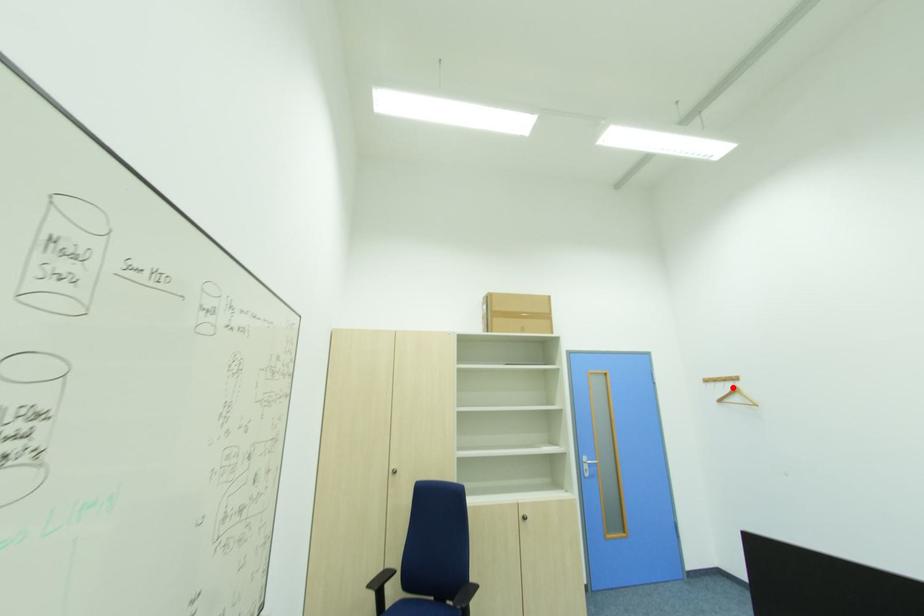
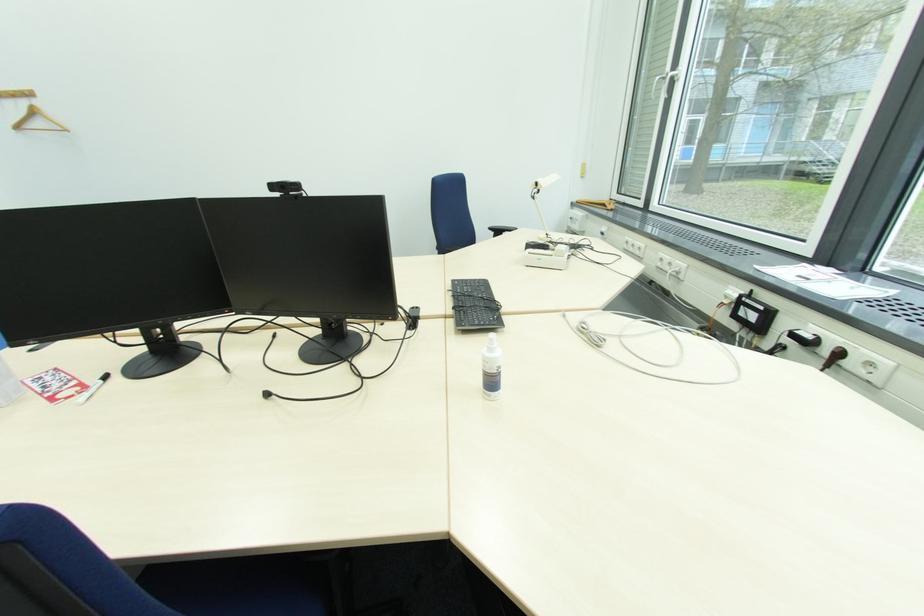
Question: I am providing you with two images of the same scene from different viewpoints. A red point is shown in image1. For the corresponding object point in image2, is it positioned nearer or farther from the camera?

Choices:
 (A) Nearer
 (B) Farther

Answer: (B)